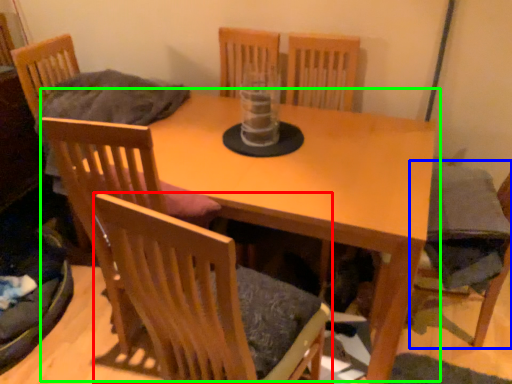
Question: Which is farther away from chair (highlighted by a red box)? armchair (highlighted by a blue box) or table (highlighted by a green box)?

Choices:
 (A) armchair
 (B) table

Answer: (A)